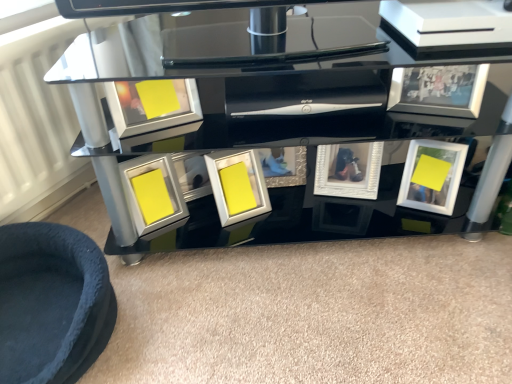
This screenshot has height=384, width=512. Find the location of `vacant space in front of black glass table at center`. vacant space in front of black glass table at center is located at coordinates (321, 309).